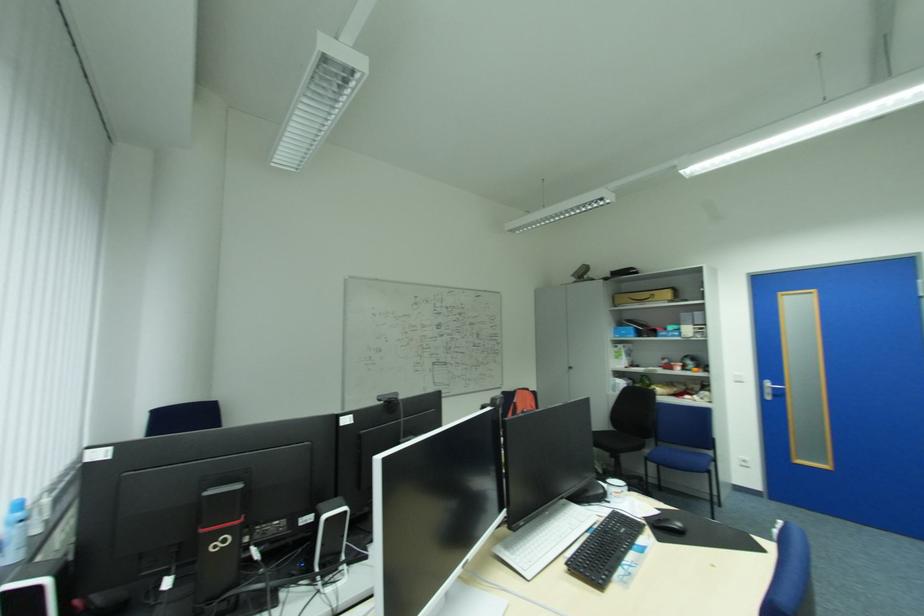
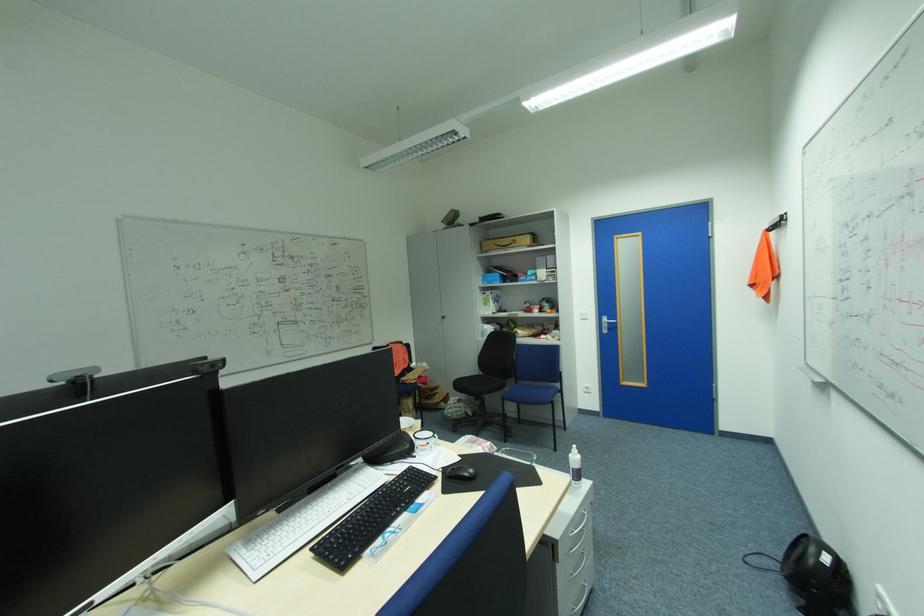
Question: The camera is either moving clockwise (left) or counter-clockwise (right) around the object. The first image is from the beginning of the video and the second image is from the end. Is the camera moving left or right when shooting the video?

Choices:
 (A) Left
 (B) Right

Answer: (A)